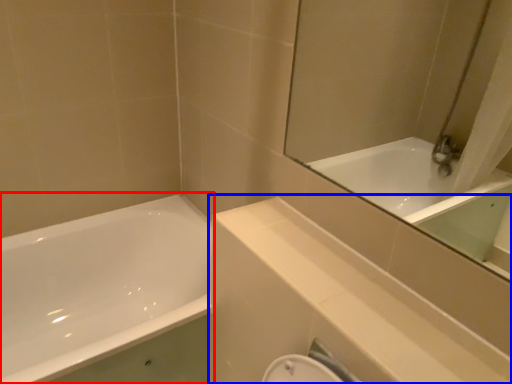
Question: Which object appears closest to the camera in this image, bathtub (highlighted by a red box) or balustrade (highlighted by a blue box)?

Choices:
 (A) bathtub
 (B) balustrade

Answer: (B)